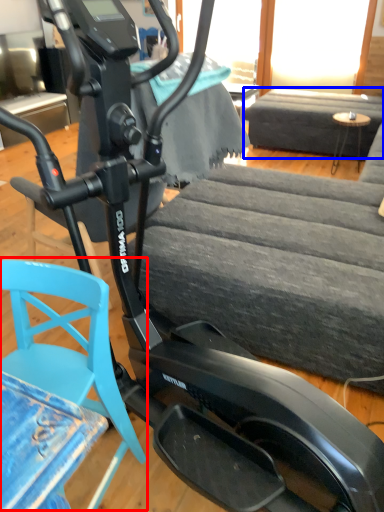
Question: Among these objects, which one is farthest to the camera, swivel chair (highlighted by a red box) or couch (highlighted by a blue box)?

Choices:
 (A) swivel chair
 (B) couch

Answer: (B)